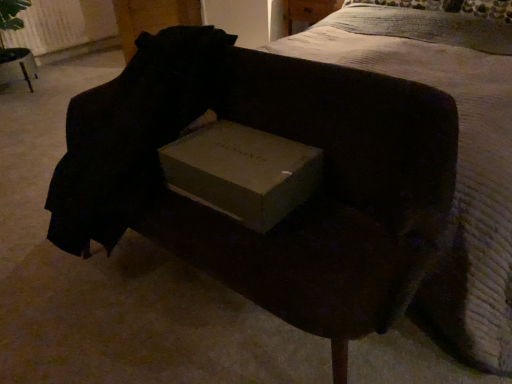
Question: Should I look upward or downward to see matte cardboard box at center?

Choices:
 (A) down
 (B) up

Answer: (B)

Question: From the image's perspective, is matte cardboard box at center located above white textured bed at upper center?

Choices:
 (A) yes
 (B) no

Answer: (B)

Question: Does matte cardboard box at center appear on the left side of white textured bed at upper center?

Choices:
 (A) yes
 (B) no

Answer: (A)

Question: Considering the relative sizes of matte cardboard box at center and white textured bed at upper center in the image provided, is matte cardboard box at center shorter than white textured bed at upper center?

Choices:
 (A) no
 (B) yes

Answer: (B)

Question: Could you tell me if matte cardboard box at center is facing white textured bed at upper center?

Choices:
 (A) yes
 (B) no

Answer: (B)

Question: Is matte cardboard box at center surrounding white textured bed at upper center?

Choices:
 (A) yes
 (B) no

Answer: (B)

Question: Is matte cardboard box at center thinner than white textured bed at upper center?

Choices:
 (A) no
 (B) yes

Answer: (B)

Question: Is matte cardboard box at center with matte cardboard box at center?

Choices:
 (A) no
 (B) yes

Answer: (A)

Question: Is the depth of matte cardboard box at center greater than that of matte cardboard box at center?

Choices:
 (A) no
 (B) yes

Answer: (A)

Question: From the image's perspective, is matte cardboard box at center located above matte cardboard box at center?

Choices:
 (A) no
 (B) yes

Answer: (B)

Question: Is matte cardboard box at center at the right side of matte cardboard box at center?

Choices:
 (A) no
 (B) yes

Answer: (A)

Question: Could you tell me if matte cardboard box at center is facing matte cardboard box at center?

Choices:
 (A) yes
 (B) no

Answer: (B)

Question: Is matte cardboard box at center wider than matte cardboard box at center?

Choices:
 (A) yes
 (B) no

Answer: (A)

Question: From a real-world perspective, is white textured bed at upper center positioned over matte cardboard box at center based on gravity?

Choices:
 (A) no
 (B) yes

Answer: (A)